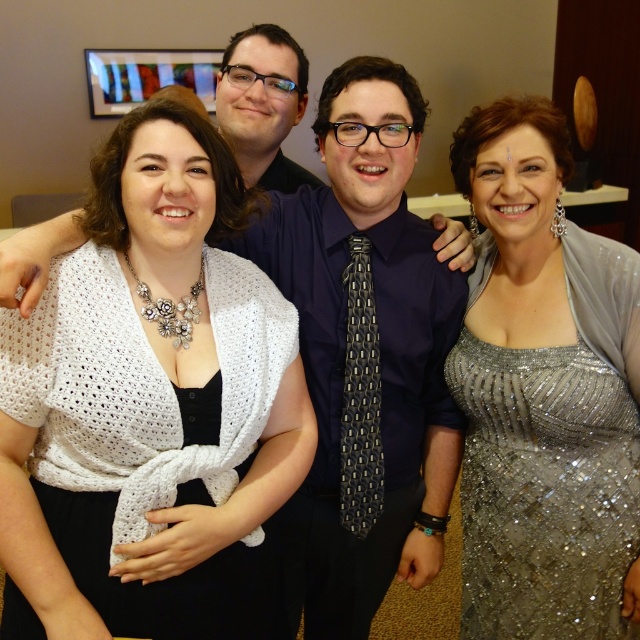
You are a photographer at a formal event. You want to adjust the lighting so that the white knitted shawl at center and the sparkly silver dress at right are both visible. Which object might need more light because it is positioned farther away from the camera?

The white knitted shawl at center is behind the sparkly silver dress at right, so it is farther away from the camera and might need more light to ensure visibility.

You are a photographer at the event and want to ensure that the sparkly silver dress at right and the white knitted shawl at center are both visible in the photo. Based on their positions, which one is lower in the frame?

The sparkly silver dress at right is below the white knitted shawl at center, so the sparkly silver dress at right is lower in the frame.